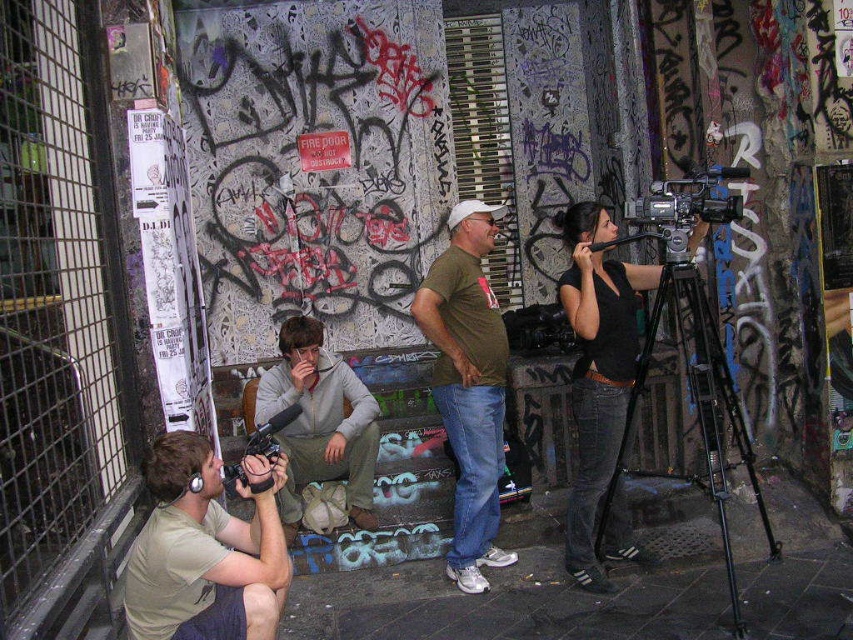
You are standing at the center of the image. Where is the black matte camera at right located relative to your position?

The black matte camera at right is located to the right side of your position at point coordinates (596, 369).

You are a photographer trying to set up equipment in the scene. Which of the two cameras, the black matte camera at right or the matte black video camera at lower left, requires less space to place on a shelf?

The black matte camera at right occupies less space than the matte black video camera at lower left, so it requires less space to place on a shelf.